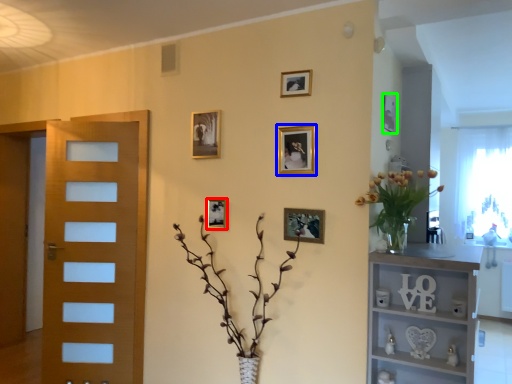
Question: Which object is the farthest from picture frame (highlighted by a red box)? Choose among these: picture frame (highlighted by a blue box) or picture frame (highlighted by a green box).

Choices:
 (A) picture frame
 (B) picture frame

Answer: (B)